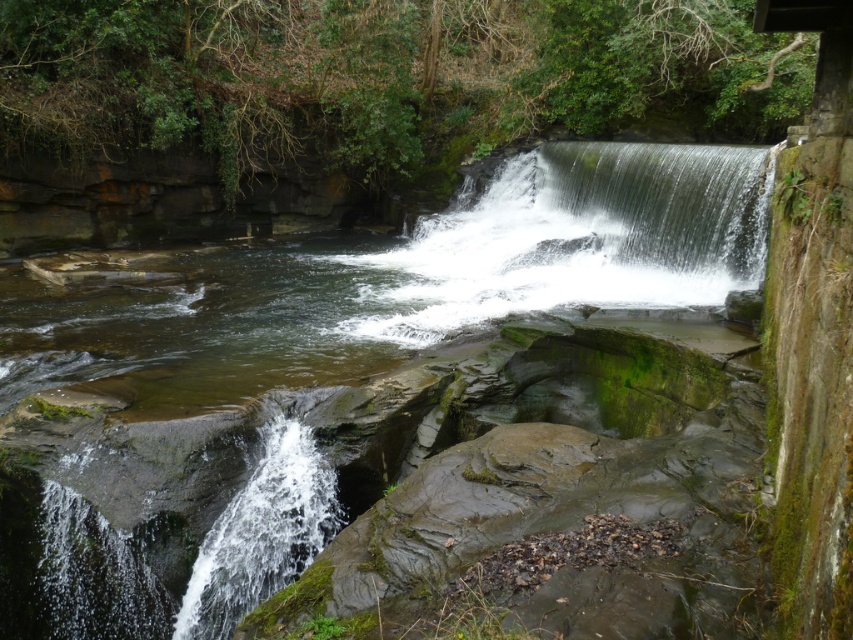
Question: Can you confirm if clear water at center is wider than green mossy rock at center?

Choices:
 (A) no
 (B) yes

Answer: (B)

Question: Which point appears closest to the camera in this image?

Choices:
 (A) (459, 220)
 (B) (619, 196)

Answer: (B)

Question: Does clear water at center have a smaller size compared to green mossy rock at center?

Choices:
 (A) yes
 (B) no

Answer: (B)

Question: Which object is farther from the camera taking this photo?

Choices:
 (A) clear water at center
 (B) green mossy rock at center

Answer: (B)

Question: Does clear water at center come behind green mossy rock at center?

Choices:
 (A) no
 (B) yes

Answer: (A)